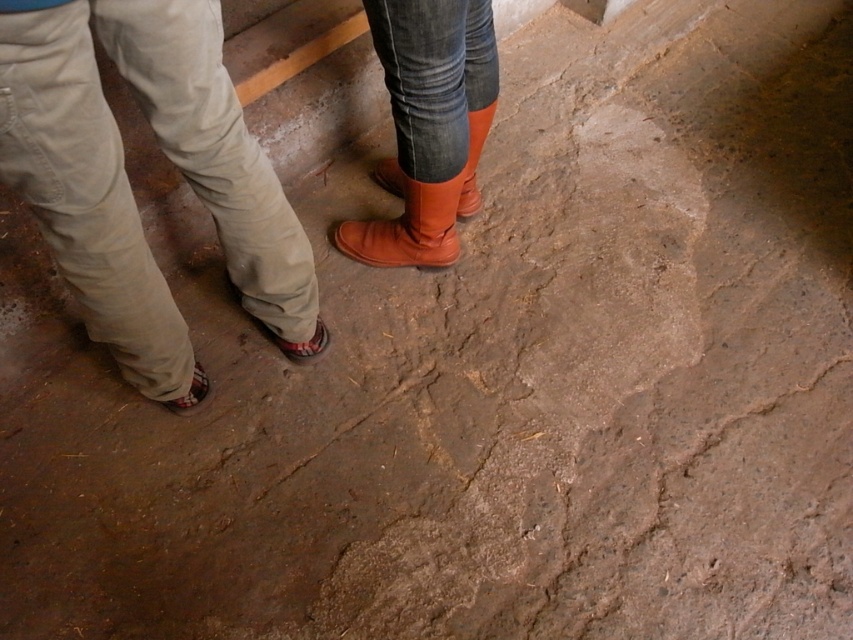
You are standing at the point marked by coordinates point (126, 179) in the image. Which object is directly in front of you?

The point (126, 179) marks khaki pants at left, so the khaki pants at left is directly in front of you.

You are a photographer setting up a shoot in this scene. You want to ensure that both the brown leather boots at center and the matte orange boot at center are clearly visible in the final photo. Given their current positions, which boot should you focus on first to ensure both are in focus?

The brown leather boots at center is in front of the matte orange boot at center, so focusing on the brown leather boots at center first will ensure both are in focus since it is closer to the camera.

You are a photographer setting up a tripod in the scene described. You need to place it exactly where the matte leather boot at center is currently located. The coordinates for placement are given as a point between 0 and 1 in both x and y axes. What are the coordinates you should use?

The coordinates for the matte leather boot at center are point (407, 228), so you should place the tripod at those coordinates.